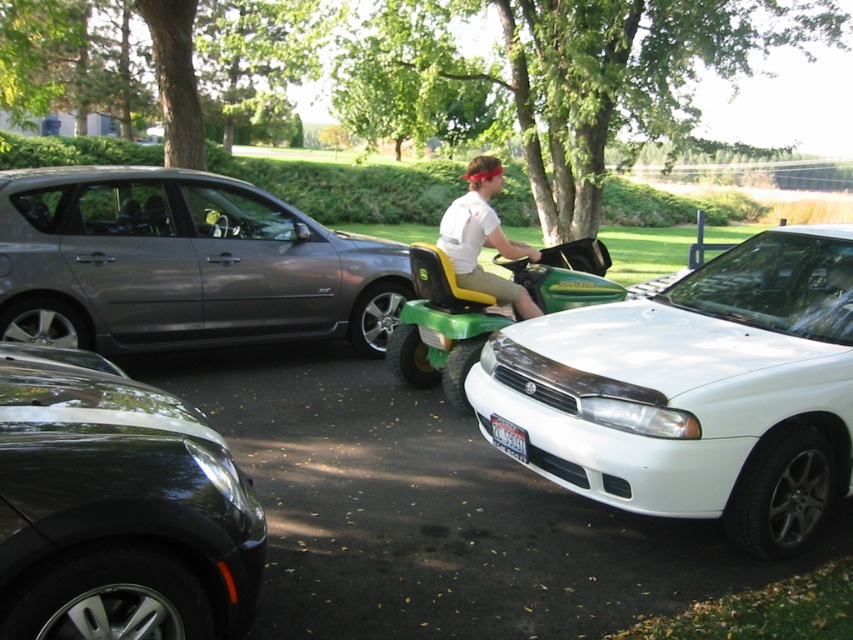
You are standing at the edge of the parking lot and want to take a photo of the glossy black car at lower left and the white plastic license plate at lower center. Which object should you focus on first to ensure both are in sharp focus?

The glossy black car at lower left is closer to the viewer than the white plastic license plate at lower center. To ensure both are in sharp focus, focus on the glossy black car at lower left since it is closer.

You are standing at the parking lot and want to take a photo of the green and yellow riding lawnmower. You notice two points marked in the image. The first point is at coordinates point (502, 252) and the second point is at point (511, 444). Which point is closer to you when you are facing the scene?

Point (511, 444) is closer to you because it is less further to the camera than point (502, 252).